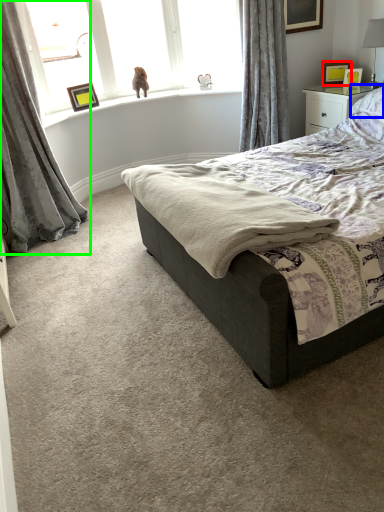
Question: Which object is the closest to the picture frame (highlighted by a red box)? Choose among these: pillow (highlighted by a blue box) or curtain (highlighted by a green box).

Choices:
 (A) pillow
 (B) curtain

Answer: (A)